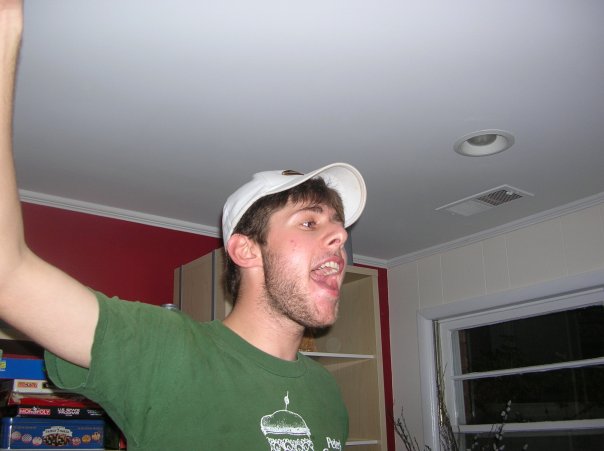
Locate an element on the screen. This screenshot has height=451, width=604. ceiling is located at coordinates (402, 111).